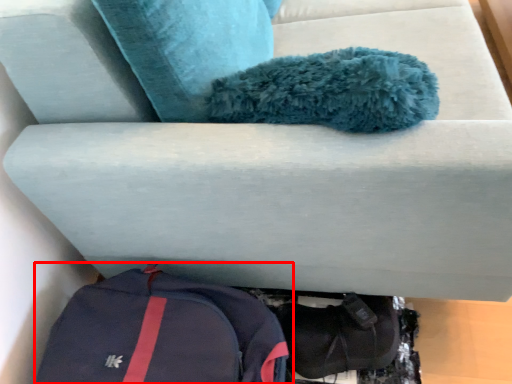
Question: From the image's perspective, what is the correct spatial relationship of backpack (annotated by the red box) in relation to shoe?

Choices:
 (A) above
 (B) below

Answer: (A)